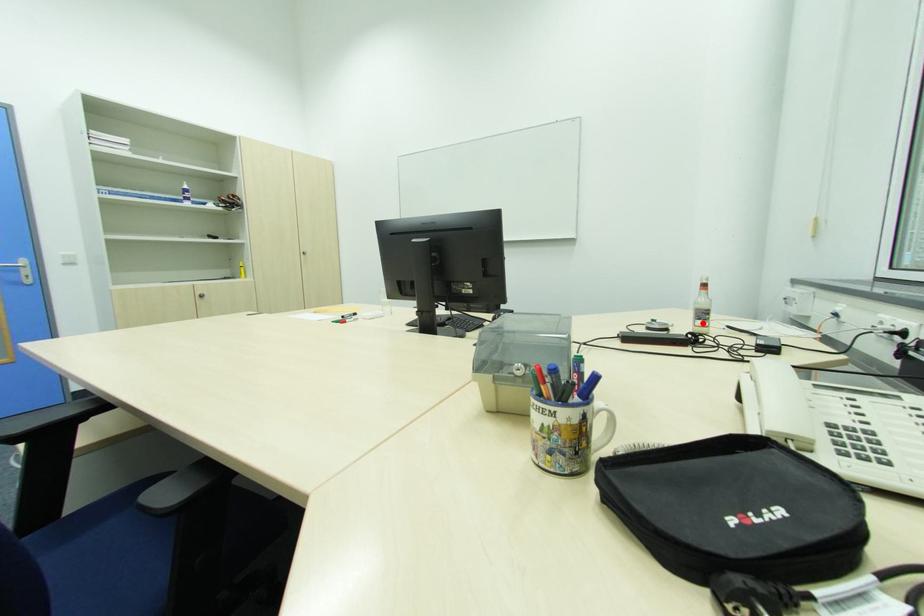
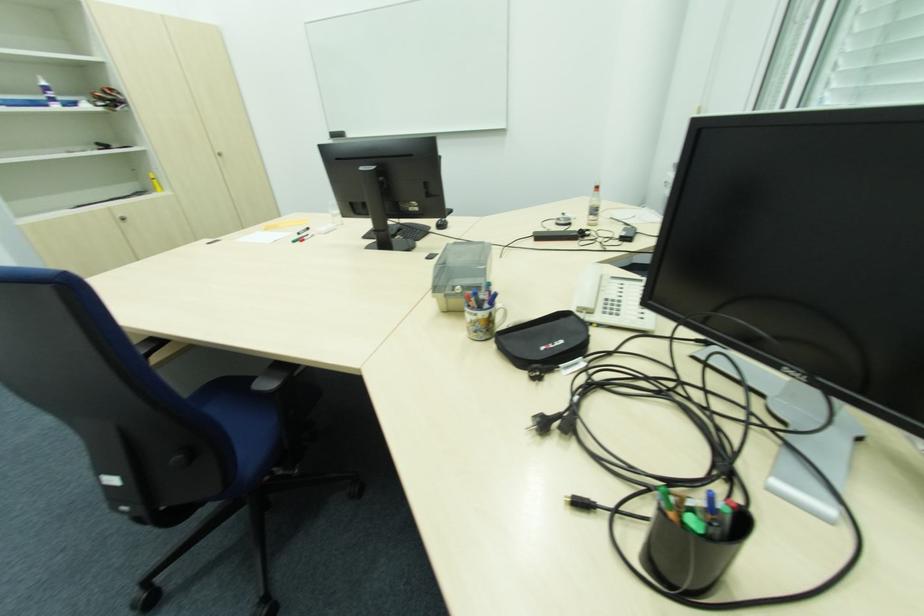
Where in the second image is the point corresponding to the highlighted location from the first image?

(594, 217)